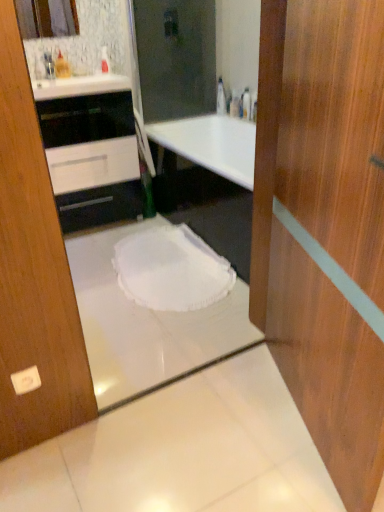
The height and width of the screenshot is (512, 384). What do you see at coordinates (47, 18) in the screenshot?
I see `matte glass mirror at upper left` at bounding box center [47, 18].

Locate an element on the screen. This screenshot has height=512, width=384. transparent plastic bottle at upper center is located at coordinates (221, 97).

Where is `black glossy cabinet at upper left`? Image resolution: width=384 pixels, height=512 pixels. black glossy cabinet at upper left is located at coordinates (92, 158).

Measure the distance from matte glass mirror at upper left to transparent plastic bottle at upper center.

matte glass mirror at upper left and transparent plastic bottle at upper center are 1.36 meters apart.

Considering the relative positions of matte glass mirror at upper left and transparent plastic bottle at upper center in the image provided, is matte glass mirror at upper left to the left or to the right of transparent plastic bottle at upper center?

matte glass mirror at upper left is to the left of transparent plastic bottle at upper center.

Considering the positions of objects matte glass mirror at upper left and transparent plastic bottle at upper center in the image provided, who is in front, matte glass mirror at upper left or transparent plastic bottle at upper center?

matte glass mirror at upper left is more forward.

Considering the points (68, 11) and (220, 111), which point is in front, point (68, 11) or point (220, 111)?

The point (68, 11) is more forward.

Considering the relative sizes of transparent plastic bottle at upper center and black glossy cabinet at upper left in the image provided, is transparent plastic bottle at upper center wider than black glossy cabinet at upper left?

No, transparent plastic bottle at upper center is not wider than black glossy cabinet at upper left.

Identify the location of cabinetry in front of the transparent plastic bottle at upper center. [x=92, y=158].

Is transparent plastic bottle at upper center not inside black glossy cabinet at upper left?

That's correct, transparent plastic bottle at upper center is outside of black glossy cabinet at upper left.

Based on the photo, which is more to the right, transparent plastic bottle at upper center or black glossy cabinet at upper left?

Positioned to the right is transparent plastic bottle at upper center.

Does matte glass mirror at upper left turn towards white fabric toilet at center?

No, matte glass mirror at upper left does not turn towards white fabric toilet at center.

Between matte glass mirror at upper left and white fabric toilet at center, which one has more height?

matte glass mirror at upper left.

From a real-world perspective, between matte glass mirror at upper left and white fabric toilet at center, who is vertically lower?

white fabric toilet at center is physically lower.

From the image's perspective, which is below, matte glass mirror at upper left or white fabric toilet at center?

white fabric toilet at center, from the image's perspective.

Does black glossy cabinet at upper left lie behind transparent plastic bottle at upper center?

No, it is in front of transparent plastic bottle at upper center.

Which object is positioned more to the left, black glossy cabinet at upper left or transparent plastic bottle at upper center?

From the viewer's perspective, black glossy cabinet at upper left appears more on the left side.

Can you tell me how much black glossy cabinet at upper left and transparent plastic bottle at upper center differ in facing direction?

The angle between the facing direction of black glossy cabinet at upper left and the facing direction of transparent plastic bottle at upper center is 180 degrees.

Which object is thinner, black glossy cabinet at upper left or transparent plastic bottle at upper center?

Thinner between the two is transparent plastic bottle at upper center.

Which is more to the right, transparent plastic bottle at upper center or white fabric toilet at center?

transparent plastic bottle at upper center.

Is transparent plastic bottle at upper center turned away from white fabric toilet at center?

No, transparent plastic bottle at upper center is not facing away from white fabric toilet at center.

Image resolution: width=384 pixels, height=512 pixels. Find the location of `bottle above the white fabric toilet at center (from a real-world perspective)`. bottle above the white fabric toilet at center (from a real-world perspective) is located at coordinates (221, 97).

Between point (220, 98) and point (142, 281), which one is positioned in front?

Point (142, 281)

From the image's perspective, between white glossy counter top at upper center and transparent plastic bottle at upper center, who is located below?

white glossy counter top at upper center appears lower in the image.

Identify the location of bottle directly beneath the white glossy counter top at upper center (from a real-world perspective). The height and width of the screenshot is (512, 384). (221, 97).

How different are the orientations of white glossy counter top at upper center and transparent plastic bottle at upper center in degrees?

There is a 180-degree angle between the facing directions of white glossy counter top at upper center and transparent plastic bottle at upper center.

Is white glossy counter top at upper center spatially inside transparent plastic bottle at upper center, or outside of it?

white glossy counter top at upper center is spatially situated outside transparent plastic bottle at upper center.

Can white glossy counter top at upper center be found inside matte glass mirror at upper left?

Actually, white glossy counter top at upper center is outside matte glass mirror at upper left.

Between matte glass mirror at upper left and white glossy counter top at upper center, which one appears on the left side from the viewer's perspective?

matte glass mirror at upper left is more to the left.

In terms of size, does matte glass mirror at upper left appear bigger or smaller than white glossy counter top at upper center?

Considering their sizes, matte glass mirror at upper left takes up less space than white glossy counter top at upper center.

I want to click on bottle behind the matte glass mirror at upper left, so click(x=221, y=97).

The height and width of the screenshot is (512, 384). In order to click on bottle that is above the black glossy cabinet at upper left (from a real-world perspective) in this screenshot , I will do `click(221, 97)`.

Which object lies nearer to the anchor point white fabric bath at center, transparent plastic bottle at upper center or white fabric toilet at center?

white fabric toilet at center is closer to white fabric bath at center.

Looking at the image, which one is located further to white fabric toilet at center, transparent plastic bottle at upper center or white glossy counter top at upper center?

Based on the image, transparent plastic bottle at upper center appears to be further to white fabric toilet at center.

Based on the photo, which object lies nearer to the anchor point white fabric toilet at center, white fabric bath at center or matte glass mirror at upper left?

white fabric bath at center is closer to white fabric toilet at center.

Based on their spatial positions, is white fabric bath at center or matte glass mirror at upper left closer to white glossy counter top at upper center?

matte glass mirror at upper left is positioned closer to the anchor white glossy counter top at upper center.

Based on the photo, based on their spatial positions, is black glossy cabinet at upper left or white glossy counter top at upper center further from white fabric bath at center?

white glossy counter top at upper center.

When comparing their distances from black glossy cabinet at upper left, does transparent plastic bottle at upper center or white fabric toilet at center seem closer?

white fabric toilet at center is positioned closer to the anchor black glossy cabinet at upper left.

From the image, which object appears to be nearer to white fabric toilet at center, white fabric bath at center or black glossy cabinet at upper left?

Based on the image, white fabric bath at center appears to be nearer to white fabric toilet at center.

Based on their spatial positions, is black glossy cabinet at upper left or matte glass mirror at upper left further from white fabric toilet at center?

The object further to white fabric toilet at center is matte glass mirror at upper left.

At what (x,y) coordinates should I click in order to perform the action: click on cabinetry that lies between white glossy counter top at upper center and white fabric bath at center from top to bottom. Please return your answer as a coordinate pair (x, y). Image resolution: width=384 pixels, height=512 pixels. Looking at the image, I should click on (92, 158).

Locate an element on the screen. The image size is (384, 512). cabinetry located between matte glass mirror at upper left and transparent plastic bottle at upper center in the left-right direction is located at coordinates (92, 158).

At what (x,y) coordinates should I click in order to perform the action: click on cabinetry between matte glass mirror at upper left and white fabric bath at center from top to bottom. Please return your answer as a coordinate pair (x, y). The width and height of the screenshot is (384, 512). Looking at the image, I should click on (92, 158).

You are a GUI agent. You are given a task and a screenshot of the screen. Output one action in this format:
    pyautogui.click(x=<x>, y=<y>)
    Task: Click on the cabinetry between white glossy counter top at upper center and transparent plastic bottle at upper center
    The height and width of the screenshot is (512, 384).
    Given the screenshot: What is the action you would take?
    pyautogui.click(x=92, y=158)